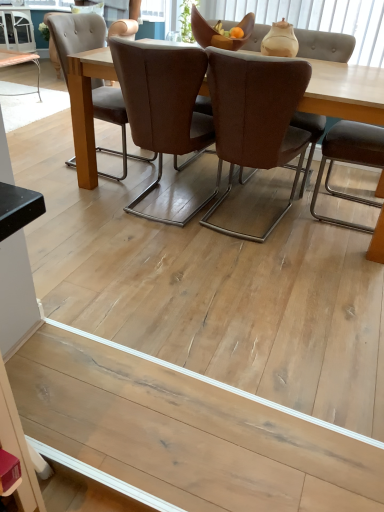
Identify the location of free space above natural wood floor at lower center (from a real-world perspective). The width and height of the screenshot is (384, 512). (174, 423).